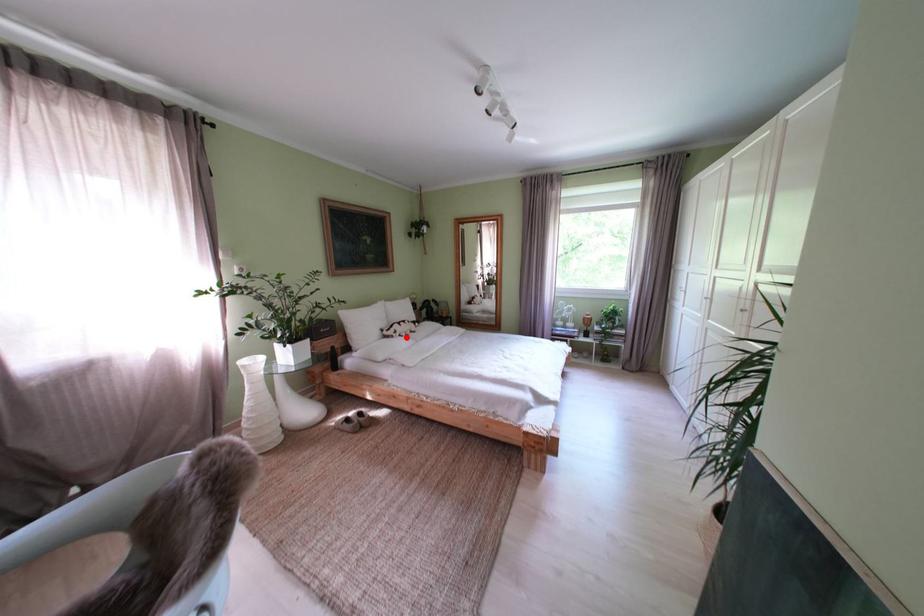
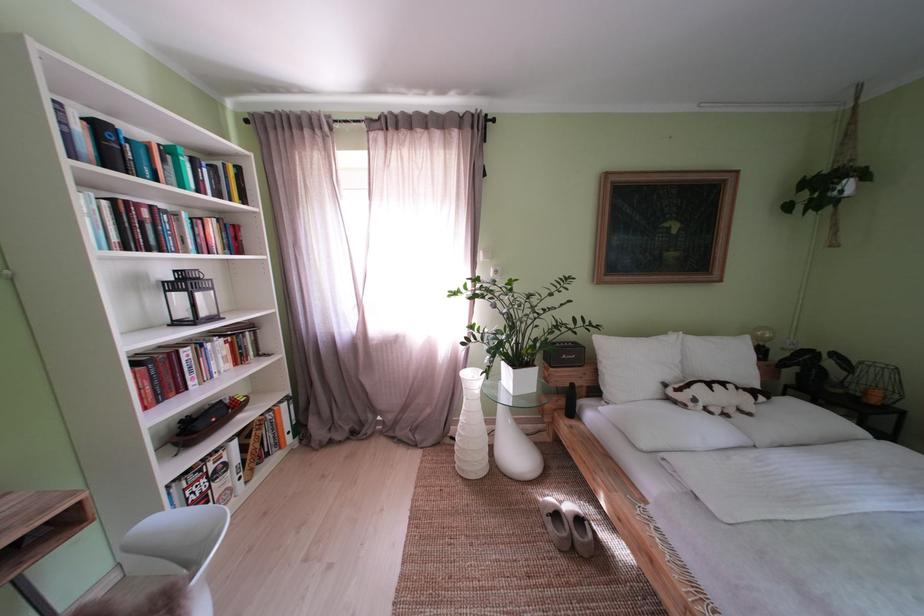
The point at the highlighted location is marked in the first image. Where is the corresponding point in the second image?

(706, 406)